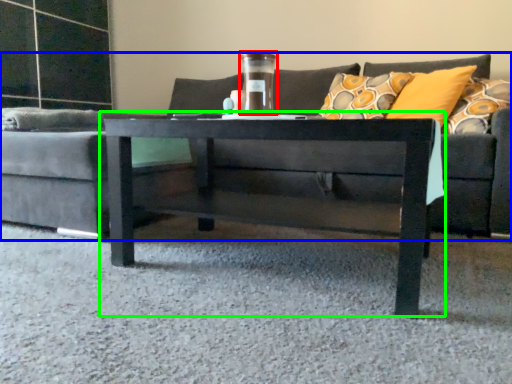
Question: Estimate the real-world distances between objects in this image. Which object is farther from glass vase (highlighted by a red box), studio couch (highlighted by a blue box) or coffee table (highlighted by a green box)?

Choices:
 (A) studio couch
 (B) coffee table

Answer: (A)